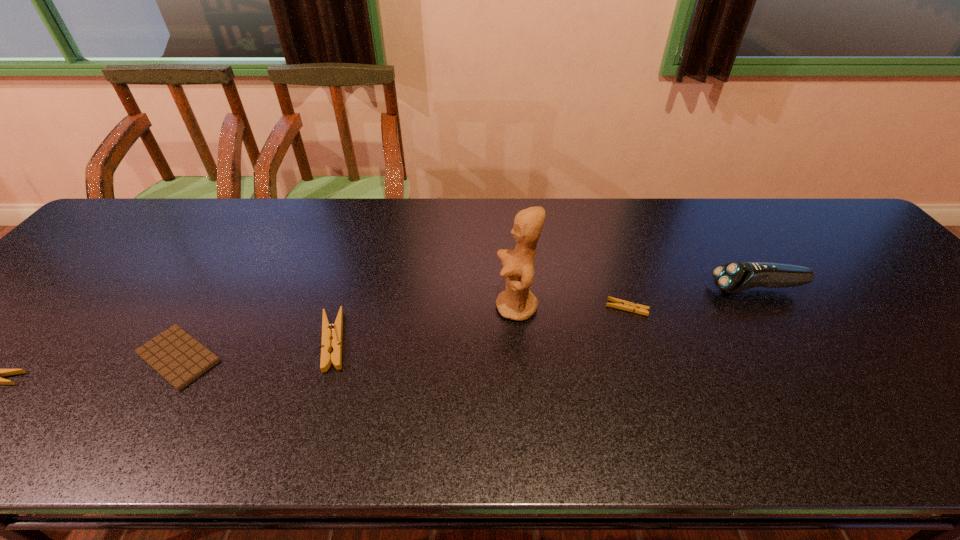
Locate which clothespin ranks third in proximity to the figurine. Please provide its 2D coordinates. Your answer should be formatted as a tuple, i.e. [(x, y)], where the tuple contains the x and y coordinates of a point satisfying the conditions above.

[(0, 373)]

Identify which clothespin is the closest to the shortest clothespin. Please provide its 2D coordinates. Your answer should be formatted as a tuple, i.e. [(x, y)], where the tuple contains the x and y coordinates of a point satisfying the conditions above.

[(329, 331)]

Where is `free space that satisfies the following two spatial constraints: 1. on the front-facing side of the tallest object; 2. on the back side of the shortest clothespin`? free space that satisfies the following two spatial constraints: 1. on the front-facing side of the tallest object; 2. on the back side of the shortest clothespin is located at coordinates (516, 308).